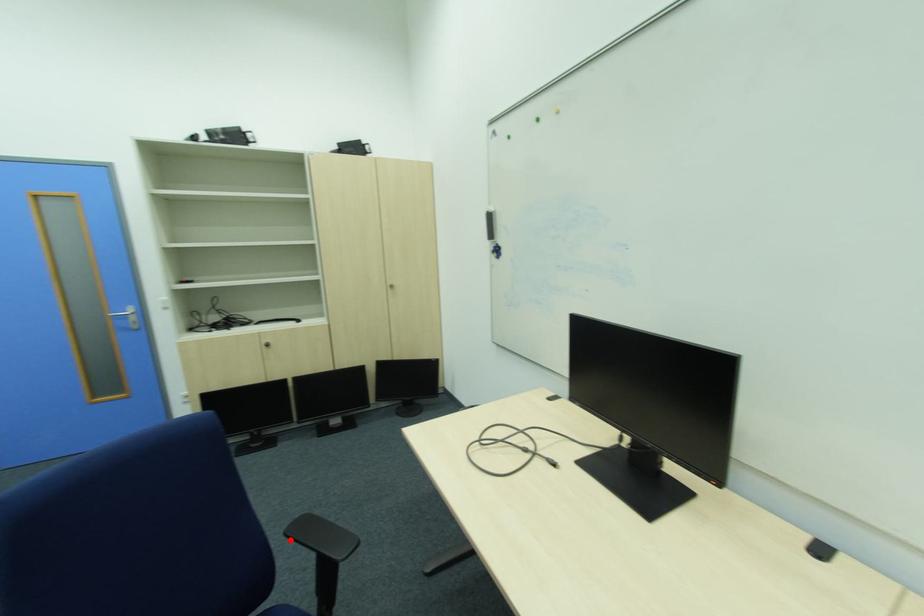
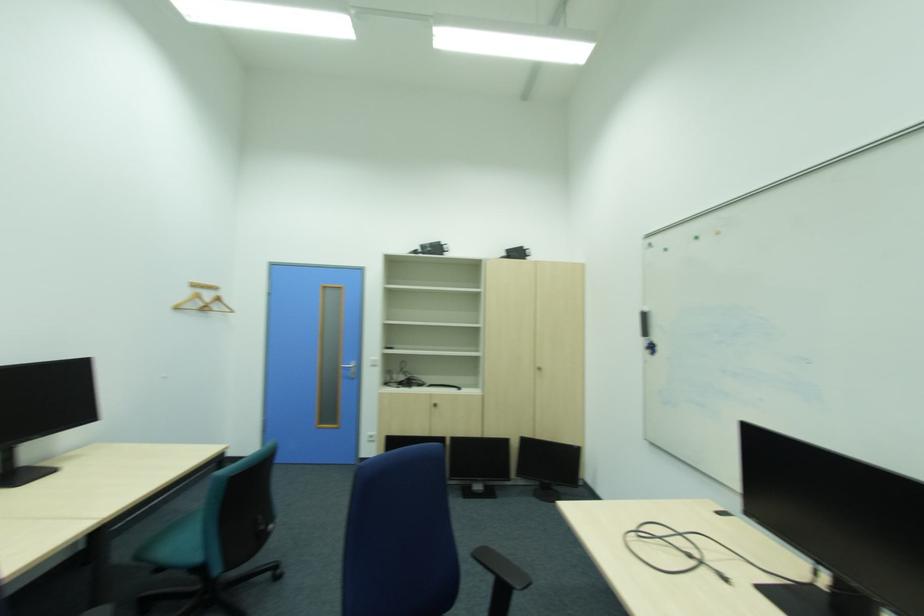
The point at the highlighted location is marked in the first image. Where is the corresponding point in the second image?

(478, 559)